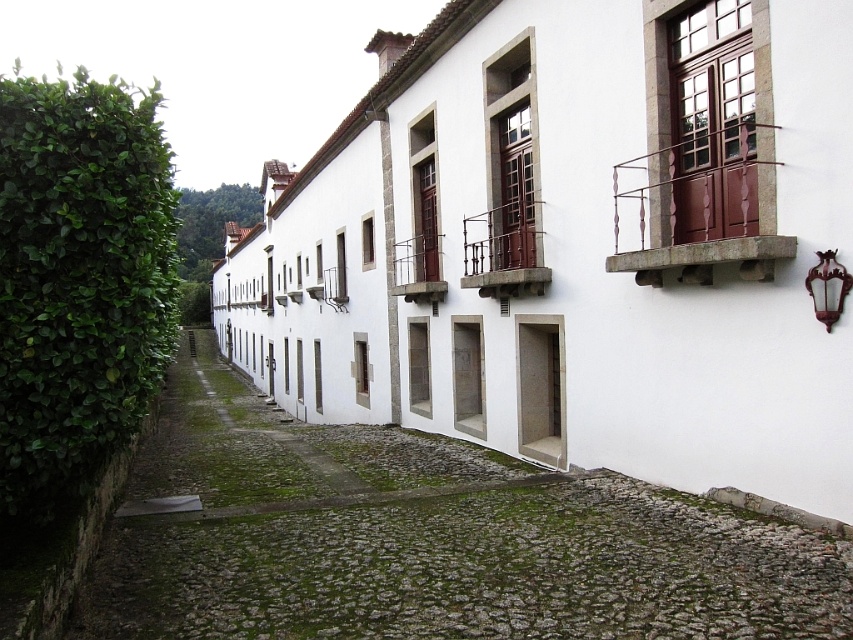
Question: Does wrought iron balcony at upper right have a greater width compared to brown wooden balcony at center?

Choices:
 (A) no
 (B) yes

Answer: (B)

Question: Which point is closer to the camera?

Choices:
 (A) (624, 518)
 (B) (172, 234)
 (C) (480, 225)
 (D) (440, 292)

Answer: (A)

Question: Which point is closer to the camera taking this photo?

Choices:
 (A) (810, 588)
 (B) (3, 195)
 (C) (735, 211)

Answer: (B)

Question: Does wrought iron balcony at upper right lie in front of rustic wood balcony at center?

Choices:
 (A) no
 (B) yes

Answer: (B)

Question: Which is farther from the green cobblestone alley at center?

Choices:
 (A) brown wooden balcony at center
 (B) wrought iron balcony at upper right
 (C) green leafy hedge at left
 (D) rustic wood balcony at center

Answer: (A)

Question: Is the position of green leafy hedge at left less distant than that of wrought iron balcony at upper right?

Choices:
 (A) yes
 (B) no

Answer: (A)